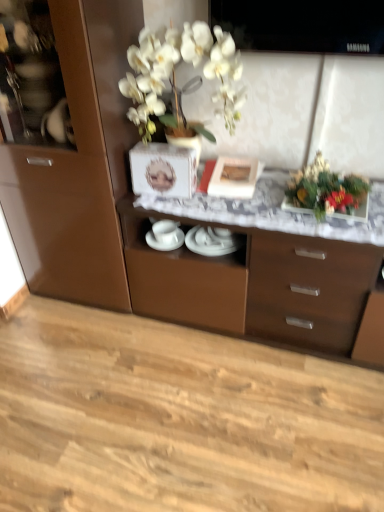
Identify the location of free space above natural wood floor at lower center (from a real-world perspective). The height and width of the screenshot is (512, 384). point(149,408).